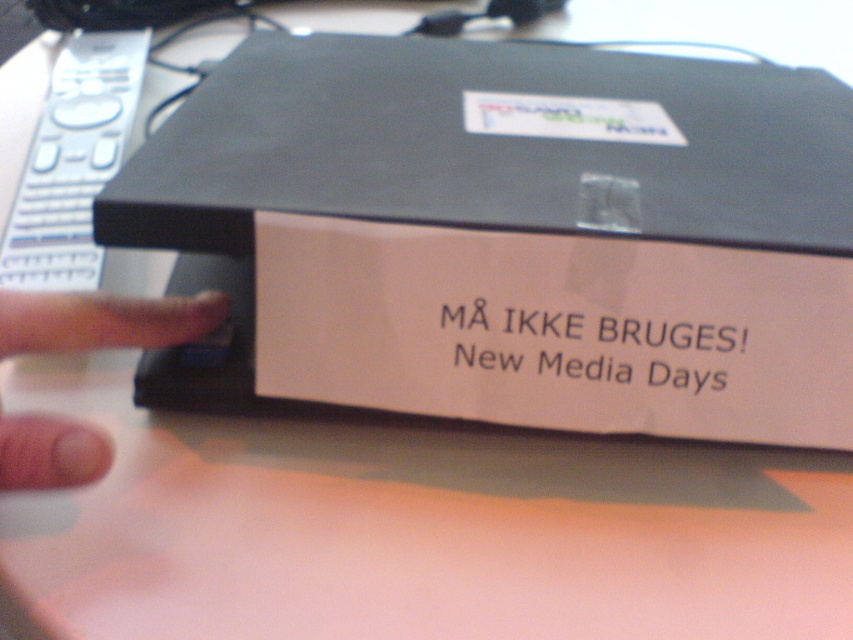
Can you confirm if white plastic remote at upper left is positioned to the left of flesh-toned skin at lower left?

Correct, you'll find white plastic remote at upper left to the left of flesh-toned skin at lower left.

Is white plastic remote at upper left positioned in front of flesh-toned skin at lower left?

That is False.

Where is `white plastic remote at upper left`? white plastic remote at upper left is located at coordinates (73, 163).

You are a GUI agent. You are given a task and a screenshot of the screen. Output one action in this format:
    pyautogui.click(x=<x>, y=<y>)
    Task: Click on the white plastic remote at upper left
    This screenshot has width=853, height=640.
    Given the screenshot: What is the action you would take?
    pyautogui.click(x=73, y=163)